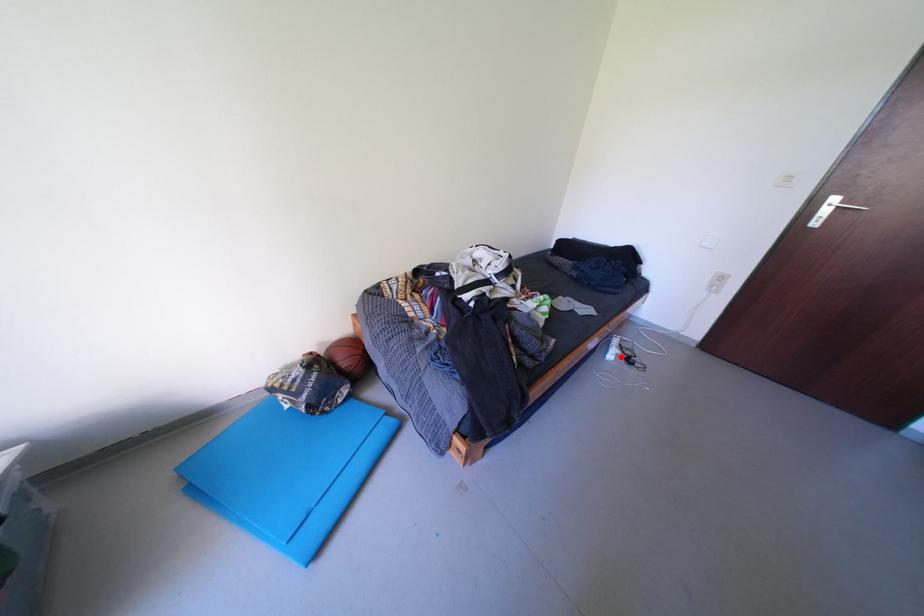
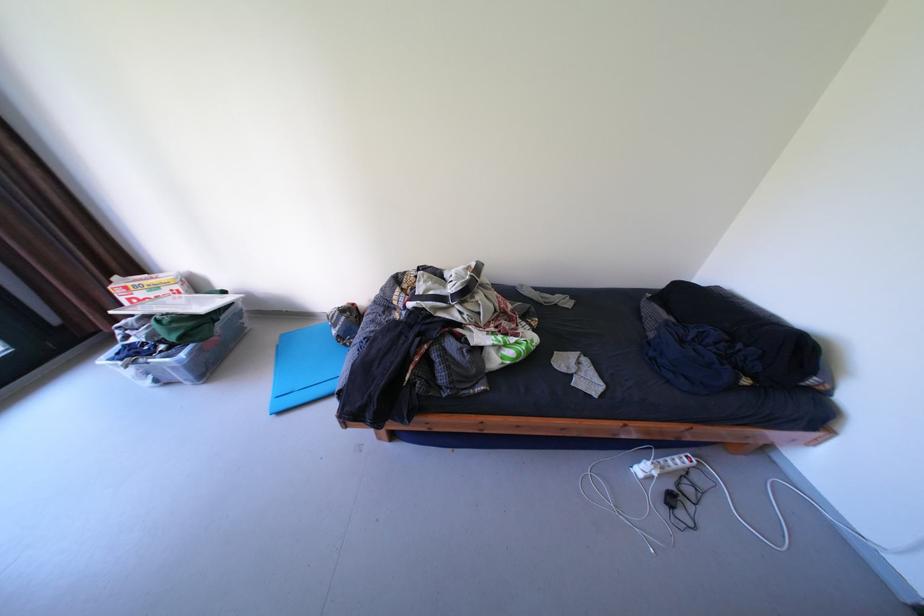
Question: A red point is marked in image1. In image2, is the corresponding 3D point closer to the camera or farther? Reply with the corresponding letter.

Choices:
 (A) The corresponding 3D point is closer.
 (B) The corresponding 3D point is farther.

Answer: (A)